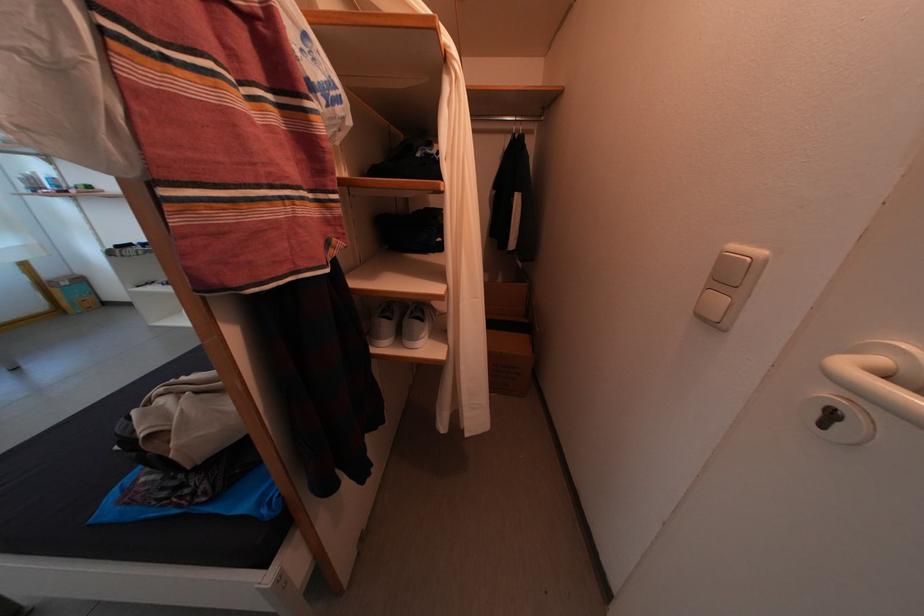
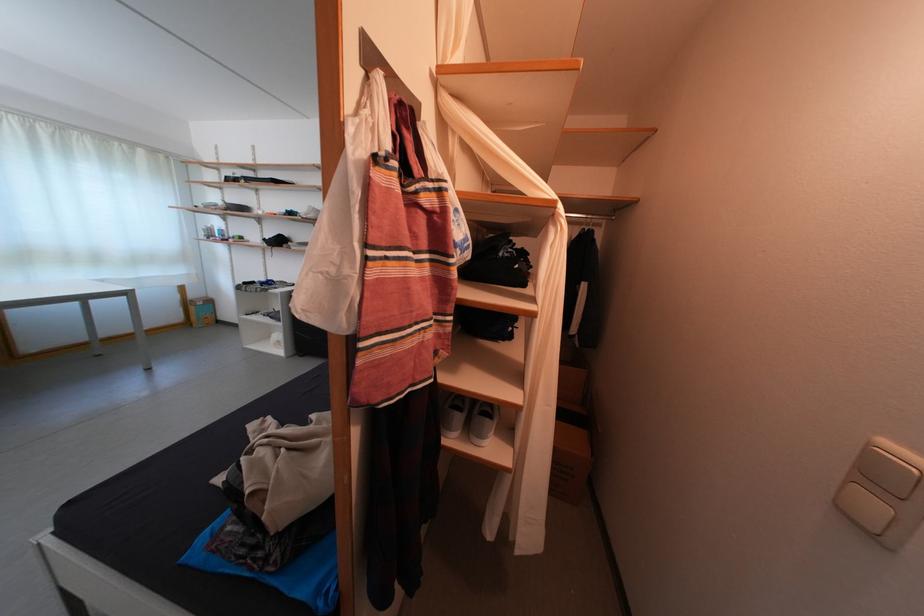
Where in the second image is the point corresponding to pixel 105 71 from the first image?

(366, 282)